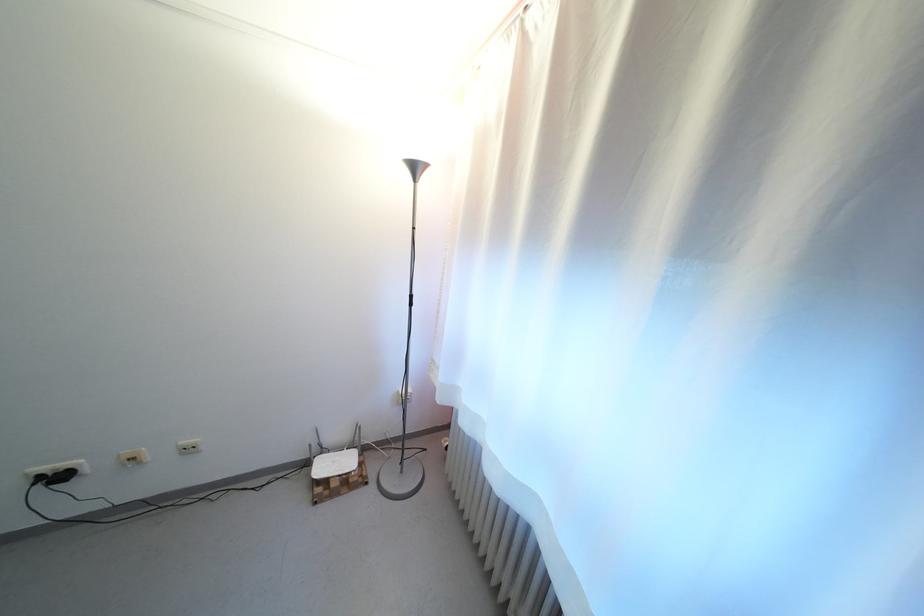
What do you see at coordinates (402, 397) in the screenshot?
I see `a lamp floor switch` at bounding box center [402, 397].